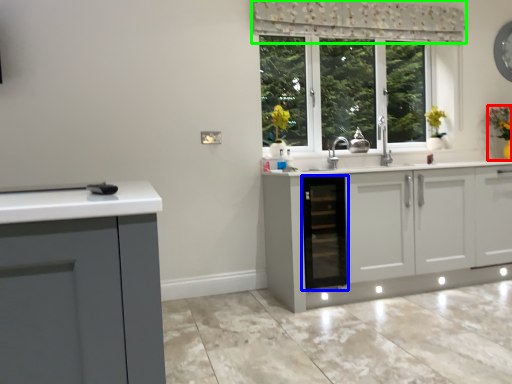
Question: Which object is the closest to the houseplant (highlighted by a red box)? Choose among these: dish washer (highlighted by a blue box) or curtain (highlighted by a green box).

Choices:
 (A) dish washer
 (B) curtain

Answer: (B)